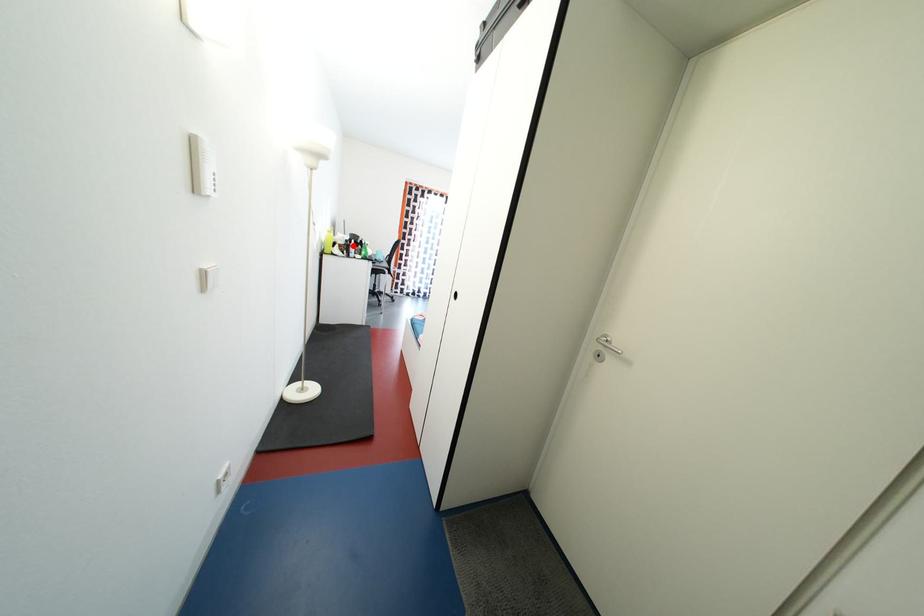
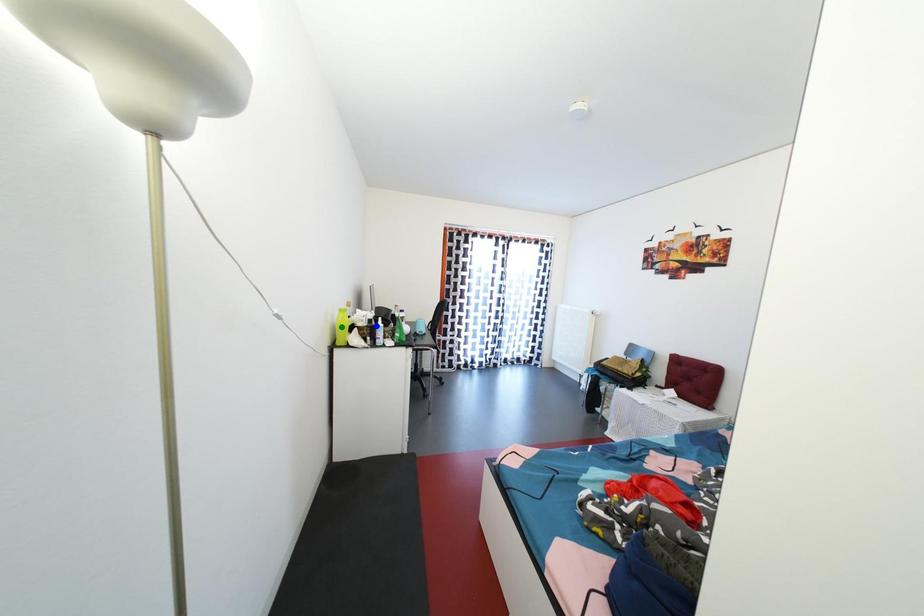
Question: I am providing you with two images of the same scene from different viewpoints. A red point is marked on the first image. You are given multiple points on the second image. In image 2, which mark is for the same physical point as the one in image 1?

Choices:
 (A) yellow point
 (B) blue point
 (C) green point

Answer: (B)